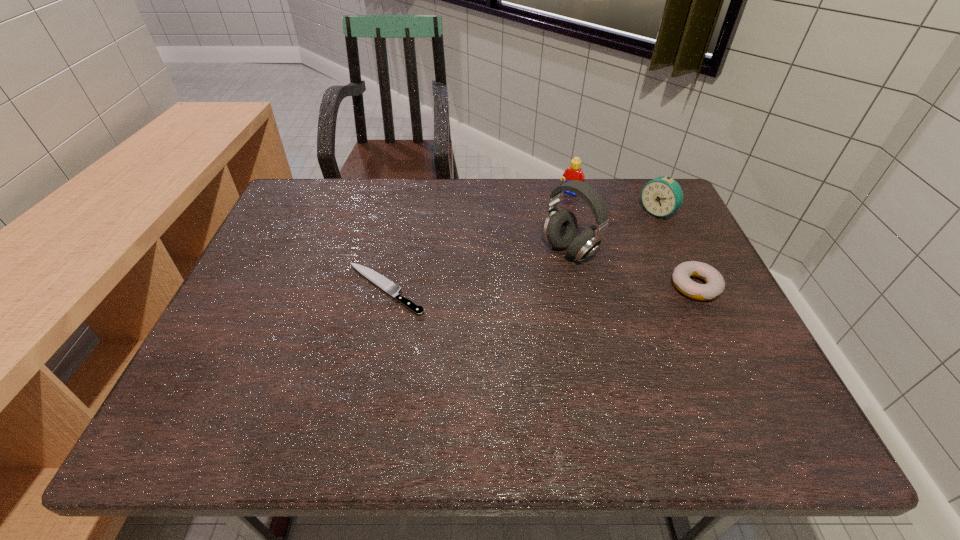
Where is `free space between the farthest object and the doughnut`? free space between the farthest object and the doughnut is located at coordinates (633, 240).

What are the coordinates of `unoccupied area between the tallest object and the alarm clock` in the screenshot? It's located at (613, 232).

I want to click on free point between the second farthest object and the farthest object, so click(613, 203).

What are the coordinates of `free space that is in between the doughnut and the tallest object` in the screenshot? It's located at (633, 268).

This screenshot has height=540, width=960. I want to click on vacant space in between the tallest object and the doughnut, so click(633, 268).

Where is `vacant region between the tallest object and the leftmost object`? The width and height of the screenshot is (960, 540). vacant region between the tallest object and the leftmost object is located at coordinates (477, 270).

Select which object is the third closest to the fourth tallest object. Please provide its 2D coordinates. Your answer should be formatted as a tuple, i.e. [(x, y)], where the tuple contains the x and y coordinates of a point satisfying the conditions above.

[(574, 172)]

Identify the location of object that is the closest to the headset. (715, 284).

Locate an element on the screen. The height and width of the screenshot is (540, 960). vacant area in the image that satisfies the following two spatial constraints: 1. on the back side of the leftmost object; 2. on the left side of the headset is located at coordinates (393, 251).

Image resolution: width=960 pixels, height=540 pixels. In order to click on free space that satisfies the following two spatial constraints: 1. on the back side of the fourth nearest object; 2. on the left side of the shortest object in this screenshot , I will do `click(401, 213)`.